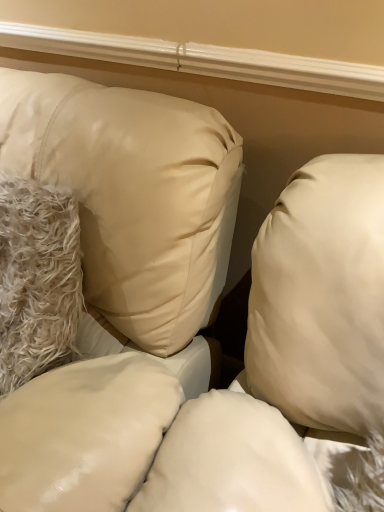
Question: Could you tell me if beige satin pillow at upper left, acting as the second pillow starting from the right, is turned towards white fluffy pillow at left, which appears as the 2th pillow when viewed from the left?

Choices:
 (A) yes
 (B) no

Answer: (A)

Question: Is beige satin pillow at upper left, the first pillow from the left, to the right of white fluffy pillow at left, which appears as the 2th pillow when viewed from the left, from the viewer's perspective?

Choices:
 (A) no
 (B) yes

Answer: (A)

Question: Can you confirm if beige satin pillow at upper left, the first pillow from the left, is taller than white fluffy pillow at left, which appears as the 2th pillow when viewed from the left?

Choices:
 (A) yes
 (B) no

Answer: (A)

Question: From a real-world perspective, does beige satin pillow at upper left, acting as the second pillow starting from the right, stand above white fluffy pillow at left, which appears as the 2th pillow when viewed from the left?

Choices:
 (A) no
 (B) yes

Answer: (A)

Question: Is beige satin pillow at upper left, the first pillow from the left, at the left side of white fluffy pillow at left, which appears as the 2th pillow when viewed from the left?

Choices:
 (A) yes
 (B) no

Answer: (A)

Question: Does beige satin pillow at upper left, acting as the second pillow starting from the right, come in front of white fluffy pillow at left, which ranks as the first pillow in right-to-left order?

Choices:
 (A) no
 (B) yes

Answer: (B)

Question: Considering the relative positions of white fluffy pillow at left, which ranks as the first pillow in right-to-left order, and beige satin pillow at upper left, the first pillow from the left, in the image provided, is white fluffy pillow at left, which ranks as the first pillow in right-to-left order, to the right of beige satin pillow at upper left, the first pillow from the left, from the viewer's perspective?

Choices:
 (A) no
 (B) yes

Answer: (B)

Question: Does white fluffy pillow at left, which appears as the 2th pillow when viewed from the left, have a lesser width compared to beige satin pillow at upper left, acting as the second pillow starting from the right?

Choices:
 (A) no
 (B) yes

Answer: (B)

Question: Considering the relative sizes of white fluffy pillow at left, which ranks as the first pillow in right-to-left order, and beige satin pillow at upper left, acting as the second pillow starting from the right, in the image provided, is white fluffy pillow at left, which ranks as the first pillow in right-to-left order, taller than beige satin pillow at upper left, acting as the second pillow starting from the right,?

Choices:
 (A) yes
 (B) no

Answer: (B)

Question: From a real-world perspective, is white fluffy pillow at left, which ranks as the first pillow in right-to-left order, over beige satin pillow at upper left, acting as the second pillow starting from the right?

Choices:
 (A) yes
 (B) no

Answer: (A)

Question: Is white fluffy pillow at left, which ranks as the first pillow in right-to-left order, wider than beige satin pillow at upper left, acting as the second pillow starting from the right?

Choices:
 (A) no
 (B) yes

Answer: (A)

Question: Is white fluffy pillow at left, which ranks as the first pillow in right-to-left order, positioned behind beige satin pillow at upper left, the first pillow from the left?

Choices:
 (A) no
 (B) yes

Answer: (B)

Question: In terms of width, does white fluffy pillow at left, which appears as the 2th pillow when viewed from the left, look wider or thinner when compared to beige satin pillow at upper left, the first pillow from the left?

Choices:
 (A) thin
 (B) wide

Answer: (A)